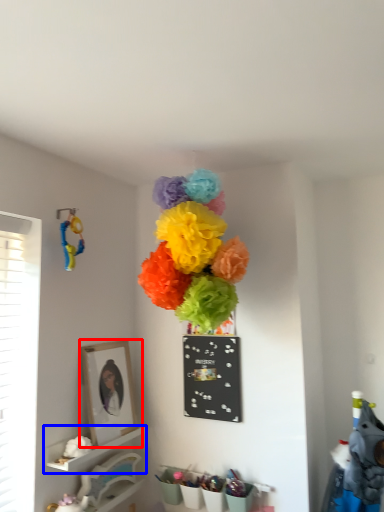
Question: Which object is closer to the camera taking this photo, picture frame (highlighted by a red box) or shelf (highlighted by a blue box)?

Choices:
 (A) picture frame
 (B) shelf

Answer: (B)